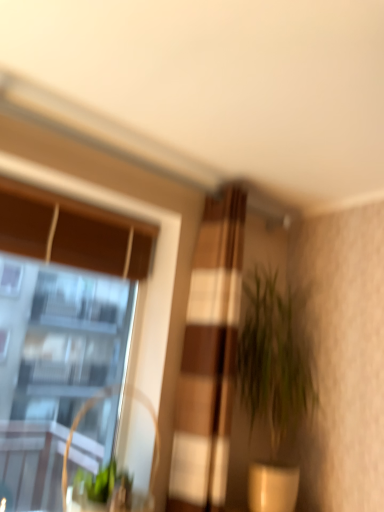
Where is `clear glass window at upper left`? clear glass window at upper left is located at coordinates (60, 321).

The height and width of the screenshot is (512, 384). What do you see at coordinates (274, 378) in the screenshot?
I see `green leafy plant at center-right` at bounding box center [274, 378].

At what (x,y) coordinates should I click in order to perform the action: click on clear glass window at upper left. Please return your answer as a coordinate pair (x, y). The height and width of the screenshot is (512, 384). Looking at the image, I should click on click(60, 321).

Between metallic silver swivel chair at left and green leafy plant at center-right, which one has larger width?

green leafy plant at center-right is wider.

Considering the positions of point (99, 508) and point (304, 327), is point (99, 508) closer or farther from the camera than point (304, 327)?

Point (99, 508).

From the picture: Does metallic silver swivel chair at left come in front of green leafy plant at center-right?

Yes.

From a real-world perspective, which object stands above the other?

green leafy plant at center-right is physically above.

From the image's perspective, which one is positioned lower, green leafy plant at center-right or clear glass window at upper left?

From the image's view, green leafy plant at center-right is below.

Could you tell me if green leafy plant at center-right is facing clear glass window at upper left?

No, green leafy plant at center-right is not aimed at clear glass window at upper left.

In terms of height, does green leafy plant at center-right look taller or shorter compared to clear glass window at upper left?

Clearly, green leafy plant at center-right is shorter compared to clear glass window at upper left.

Looking at the image, does green leafy plant at center-right seem bigger or smaller compared to clear glass window at upper left?

green leafy plant at center-right is smaller than clear glass window at upper left.

Considering the sizes of objects textured beige curtain at center and clear glass window at upper left in the image provided, who is bigger, textured beige curtain at center or clear glass window at upper left?

Bigger between the two is clear glass window at upper left.

Can you confirm if textured beige curtain at center is positioned to the left of clear glass window at upper left?

No.

Choose the correct answer: Is textured beige curtain at center inside clear glass window at upper left or outside it?

textured beige curtain at center is outside clear glass window at upper left.

From a real-world perspective, is textured beige curtain at center under clear glass window at upper left?

No, from a real-world perspective, textured beige curtain at center is not under clear glass window at upper left.

Could you tell me if textured beige curtain at center is turned towards green leafy plant at center-right?

No, textured beige curtain at center does not turn towards green leafy plant at center-right.

Would you say textured beige curtain at center is to the left or to the right of green leafy plant at center-right in the picture?

textured beige curtain at center is to the left of green leafy plant at center-right.

Can you tell me how much textured beige curtain at center and green leafy plant at center-right differ in facing direction?

The angle between the facing direction of textured beige curtain at center and the facing direction of green leafy plant at center-right is 1.87 degrees.

Is textured beige curtain at center in front of green leafy plant at center-right?

Yes, it is.

How many degrees apart are the facing directions of green leafy plant at center-right and textured beige curtain at center?

There is a 1.87-degree angle between the facing directions of green leafy plant at center-right and textured beige curtain at center.

Locate an element on the screen. curtain above the green leafy plant at center-right (from a real-world perspective) is located at coordinates (208, 358).

Is green leafy plant at center-right wider than textured beige curtain at center?

Correct, the width of green leafy plant at center-right exceeds that of textured beige curtain at center.

Between clear glass window at upper left and green leafy plant at center-right, which one has less height?

Standing shorter between the two is green leafy plant at center-right.

Is clear glass window at upper left turned away from green leafy plant at center-right?

No, clear glass window at upper left is not facing away from green leafy plant at center-right.

Is point (20, 415) in front of point (273, 394)?

No, (20, 415) is behind (273, 394).

Considering their positions, is clear glass window at upper left located in front of or behind green leafy plant at center-right?

Visually, clear glass window at upper left is located in front of green leafy plant at center-right.

This screenshot has height=512, width=384. I want to click on swivel chair that is under the clear glass window at upper left (from a real-world perspective), so click(67, 472).

Is metallic silver swivel chair at left looking in the opposite direction of clear glass window at upper left?

Yes, clear glass window at upper left is at the back of metallic silver swivel chair at left.

At what (x,y) coordinates should I click in order to perform the action: click on houseplant that is on the right side of metallic silver swivel chair at left. Please return your answer as a coordinate pair (x, y). This screenshot has width=384, height=512. Looking at the image, I should click on (274, 378).

At what (x,y) coordinates should I click in order to perform the action: click on window that is above the green leafy plant at center-right (from the image's perspective). Please return your answer as a coordinate pair (x, y). This screenshot has height=512, width=384. Looking at the image, I should click on (60, 321).

Based on their spatial positions, is textured beige curtain at center or green leafy plant at center-right further from clear glass window at upper left?

Based on the image, textured beige curtain at center appears to be further to clear glass window at upper left.

When comparing their distances from clear glass window at upper left, does textured beige curtain at center or metallic silver swivel chair at left seem further?

metallic silver swivel chair at left is further to clear glass window at upper left.

When comparing their distances from metallic silver swivel chair at left, does textured beige curtain at center or clear glass window at upper left seem closer?

The object closer to metallic silver swivel chair at left is textured beige curtain at center.

Estimate the real-world distances between objects in this image. Which object is further from metallic silver swivel chair at left, textured beige curtain at center or green leafy plant at center-right?

green leafy plant at center-right.

Based on the photo, based on their spatial positions, is metallic silver swivel chair at left or green leafy plant at center-right further from textured beige curtain at center?

metallic silver swivel chair at left is further to textured beige curtain at center.

Looking at the image, which one is located further to clear glass window at upper left, metallic silver swivel chair at left or green leafy plant at center-right?

Among the two, metallic silver swivel chair at left is located further to clear glass window at upper left.

Based on their spatial positions, is metallic silver swivel chair at left or textured beige curtain at center closer to green leafy plant at center-right?

The object closer to green leafy plant at center-right is textured beige curtain at center.

When comparing their distances from textured beige curtain at center, does metallic silver swivel chair at left or clear glass window at upper left seem closer?

metallic silver swivel chair at left.

I want to click on curtain located between clear glass window at upper left and green leafy plant at center-right in the left-right direction, so click(x=208, y=358).

Identify the location of swivel chair situated between clear glass window at upper left and textured beige curtain at center from left to right. (67, 472).

You are a GUI agent. You are given a task and a screenshot of the screen. Output one action in this format:
    pyautogui.click(x=<x>, y=<y>)
    Task: Click on the swivel chair between clear glass window at upper left and green leafy plant at center-right from left to right
    The height and width of the screenshot is (512, 384).
    Given the screenshot: What is the action you would take?
    pyautogui.click(x=67, y=472)

Where is `curtain between metallic silver swivel chair at left and green leafy plant at center-right from left to right`? The image size is (384, 512). curtain between metallic silver swivel chair at left and green leafy plant at center-right from left to right is located at coordinates point(208,358).